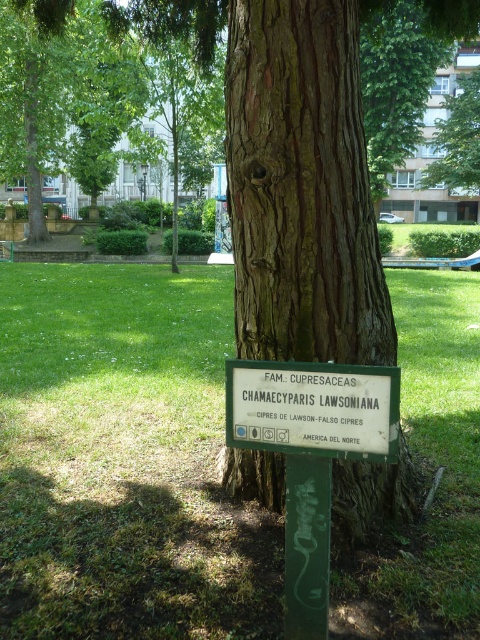
Looking at this image, you are a gardener who needs to water the green grass at center and the green plastic sign at center. Your watering can has a range of 5 feet. Can you water both objects without moving the watering can? Please explain your reasoning based on their distance.

The distance between the green grass at center and the green plastic sign at center is 7.31 feet. Since the watering can has a range of only 5 feet, you cannot water both objects without moving the watering can because the distance exceeds the canister range.

You are a park visitor who wants to read the green plastic sign at center mounted on the tree. The brown rough bark at center is in your way. Can you move the sign to a lower position so it is easier to read?

The brown rough bark at center is located above the green plastic sign at center, so the sign is already positioned below the bark. You don not need to move it lower because it is already placed in a lower position for easier reading.